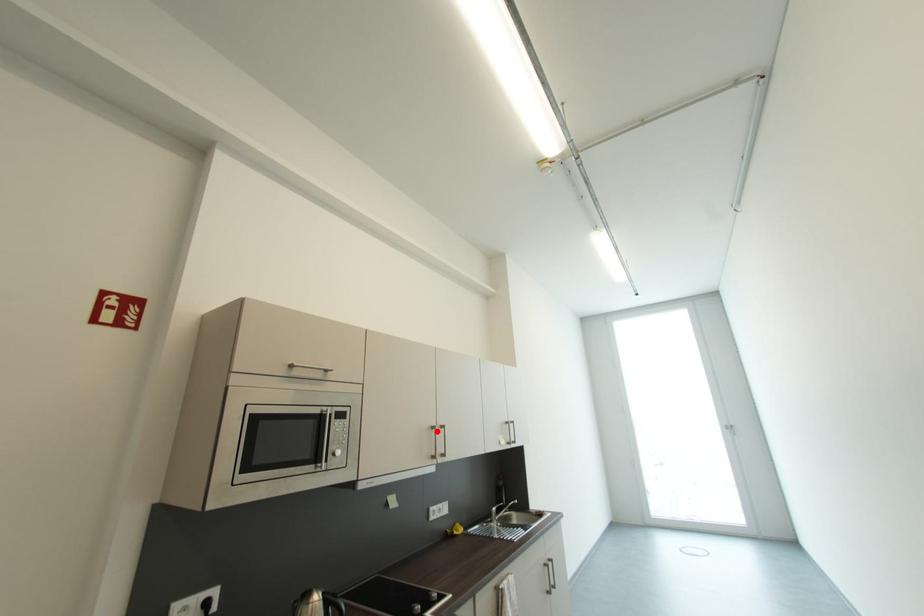
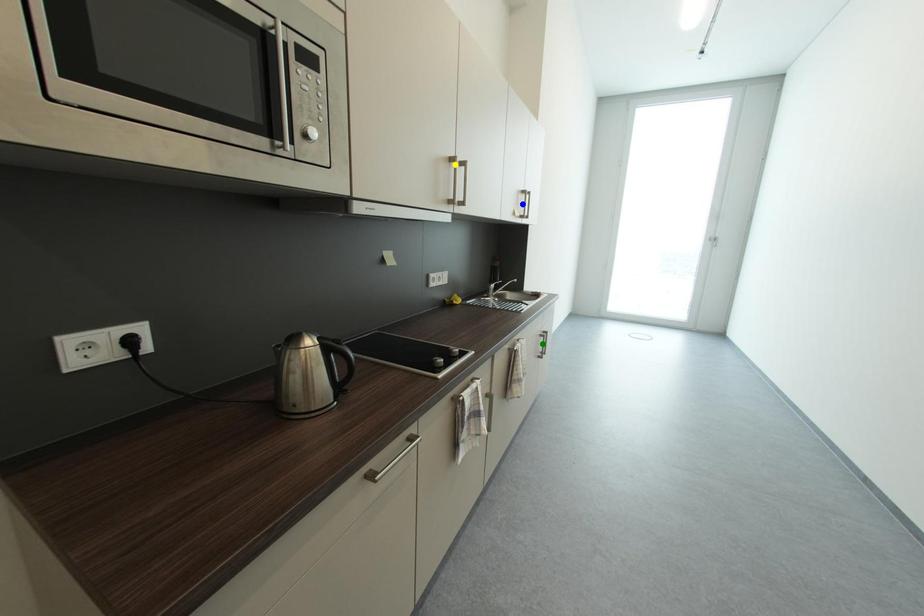
Question: I am providing you with two images of the same scene from different viewpoints. A red point is marked on the first image. You are given multiple points on the second image. In image 2, which mark is for the same physical point as the one in image 1?

Choices:
 (A) green point
 (B) yellow point
 (C) blue point

Answer: (B)